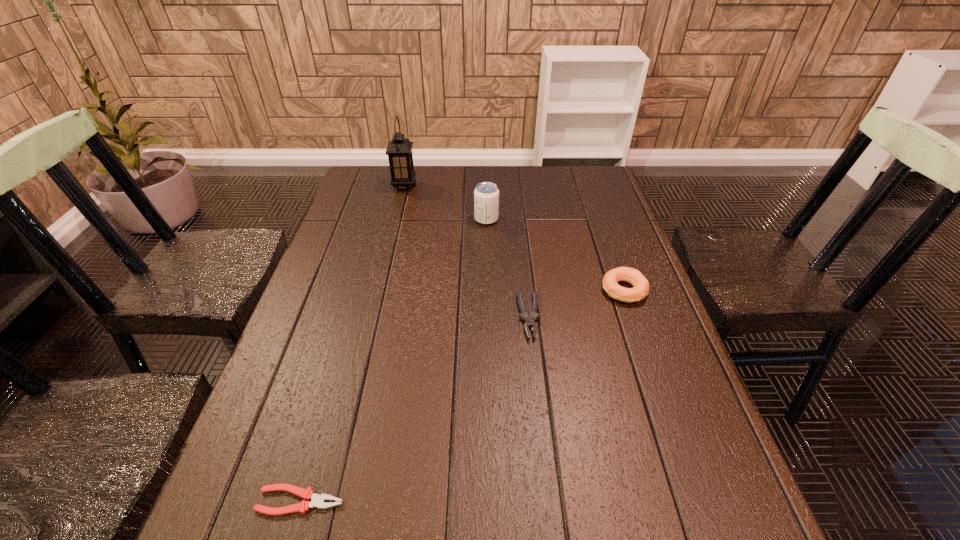
Locate an element on the screen. This screenshot has height=540, width=960. unoccupied position between the shortest object and the bagel is located at coordinates (462, 395).

Locate an element on the screen. vacant region between the tallest object and the taller pliers is located at coordinates pos(467,251).

At what (x,y) coordinates should I click in order to perform the action: click on empty space that is in between the tallest object and the farther pliers. Please return your answer as a coordinate pair (x, y). Looking at the image, I should click on (467, 251).

Locate an element on the screen. free space between the farthest object and the fourth shortest object is located at coordinates (445, 202).

Identify the location of free space between the lantern and the shorter pliers. The height and width of the screenshot is (540, 960). (352, 343).

What are the coordinates of `free spot between the taller pliers and the farthest object` in the screenshot? It's located at (467, 251).

Locate which object is the fourth closest to the right pliers. Please provide its 2D coordinates. Your answer should be formatted as a tuple, i.e. [(x, y)], where the tuple contains the x and y coordinates of a point satisfying the conditions above.

[(399, 150)]

Point out which object is positioned as the fourth nearest to the farthest object. Please provide its 2D coordinates. Your answer should be formatted as a tuple, i.e. [(x, y)], where the tuple contains the x and y coordinates of a point satisfying the conditions above.

[(318, 501)]

At what (x,y) coordinates should I click in order to perform the action: click on free location that satisfies the following two spatial constraints: 1. on the back side of the fourth shortest object; 2. on the left side of the left pliers. Please return your answer as a coordinate pair (x, y). The width and height of the screenshot is (960, 540). Looking at the image, I should click on (382, 219).

This screenshot has width=960, height=540. In order to click on free location that satisfies the following two spatial constraints: 1. on the back side of the lantern; 2. on the left side of the nearest object in this screenshot , I will do `click(392, 186)`.